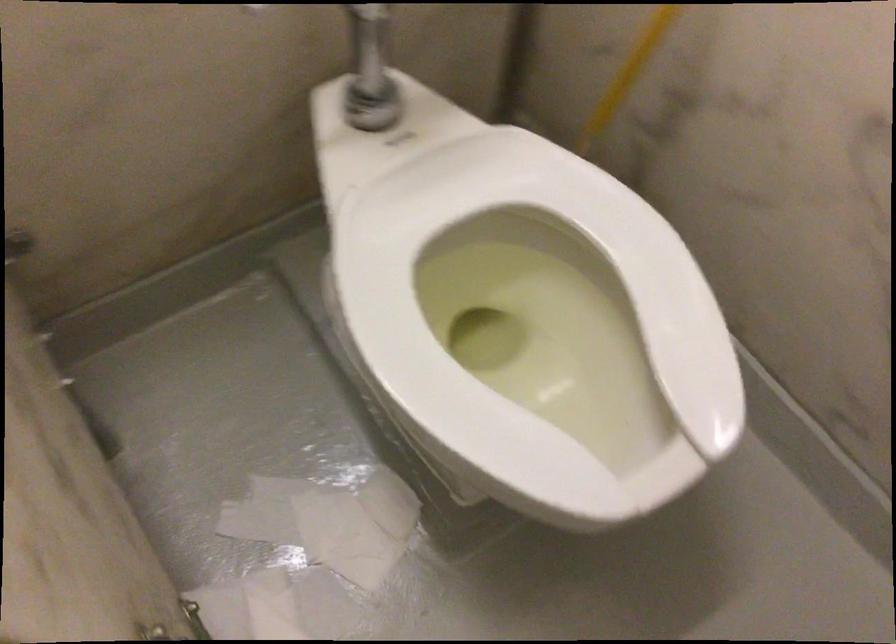
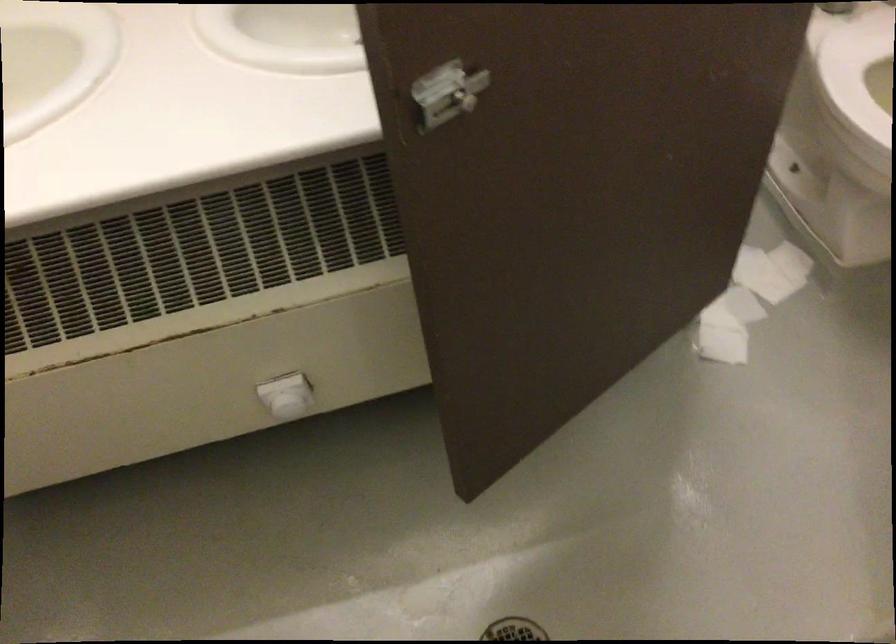
Locate, in the second image, the point that corresponds to (401,526) in the first image.

(790, 261)